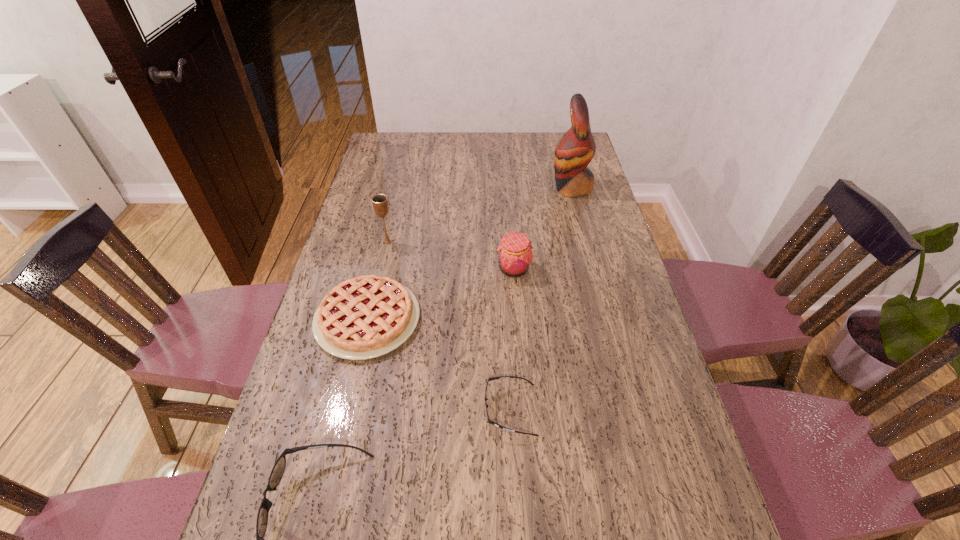
I want to click on free region located 0.310m on the front-facing side of the farther sunglasses, so click(x=349, y=409).

Locate an element on the screen. The width and height of the screenshot is (960, 540). vacant area located 0.280m on the front-facing side of the farther sunglasses is located at coordinates (363, 409).

The image size is (960, 540). What are the coordinates of `vacant point located on the left of the third farthest object` in the screenshot? It's located at (446, 269).

The height and width of the screenshot is (540, 960). I want to click on vacant space situated 0.300m on the right of the second tallest object, so [487, 242].

Image resolution: width=960 pixels, height=540 pixels. I want to click on vacant space located on the face of the parrot, so click(x=459, y=188).

Locate an element on the screen. vacant space located on the face of the parrot is located at coordinates (507, 188).

Where is `vacant region located on the face of the parrot`? vacant region located on the face of the parrot is located at coordinates (457, 188).

Locate an element on the screen. The width and height of the screenshot is (960, 540). vacant space situated on the back of the third nearest object is located at coordinates (381, 261).

Where is `chalice that is at the left edge`? This screenshot has width=960, height=540. chalice that is at the left edge is located at coordinates (380, 203).

Locate an element on the screen. Image resolution: width=960 pixels, height=540 pixels. pie at the left edge is located at coordinates click(x=365, y=317).